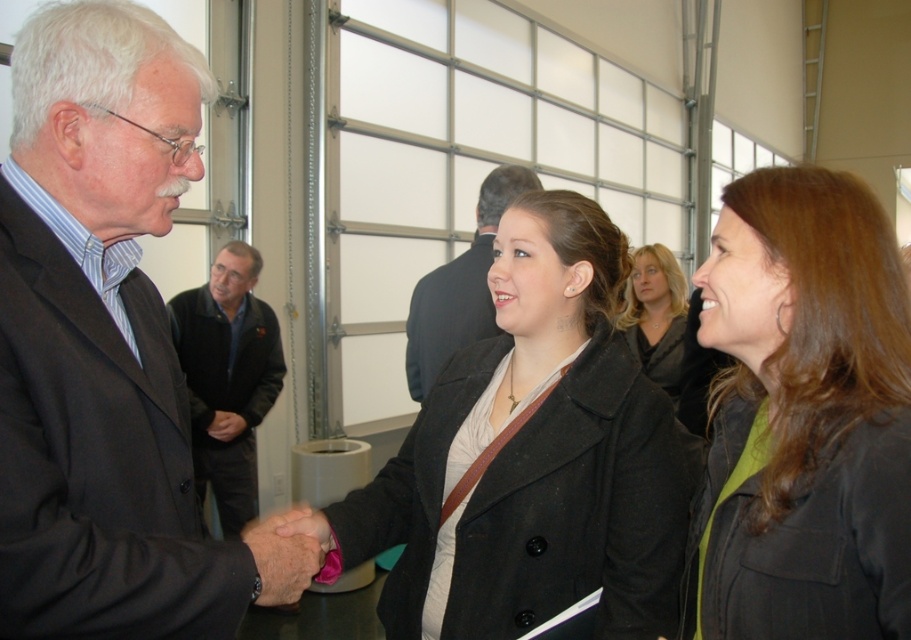
You are standing in the room and see two points marked in the image. Which point is closer to you, point (229, 268) or point (425, 372)?

Point (229, 268) is closer to you because it is further to the viewer than point (425, 372).

You are an event planner observing the scene. You need to ensure that the black fleece jacket at center and the blonde hair at center are visible in a photo. Which object should be placed closer to the camera to ensure both are fully visible?

The black fleece jacket at center is taller than blonde hair at center. To ensure both are fully visible in the photo, position the taller object, the black fleece jacket at center, closer to the camera so that its height does not block the view of the shorter blonde hair at center.